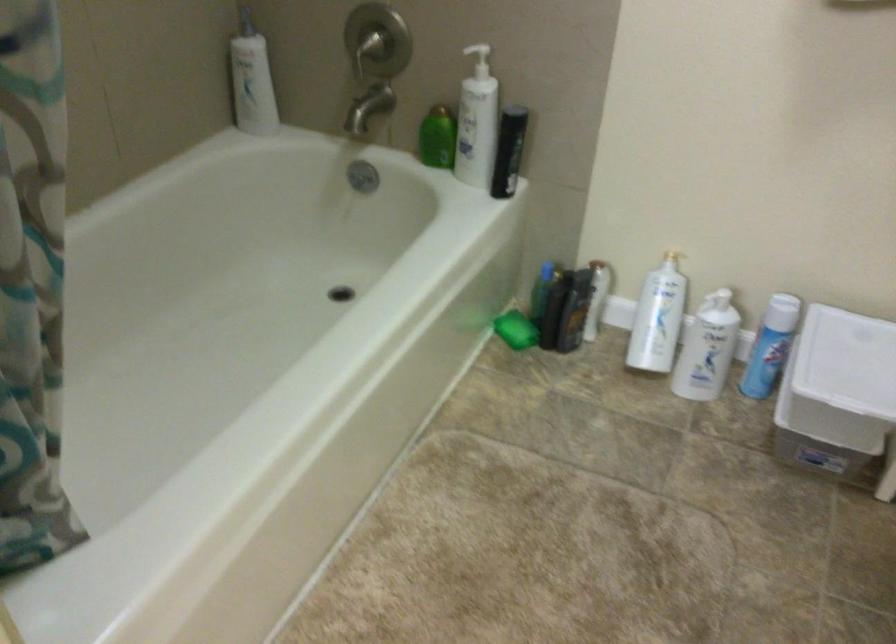
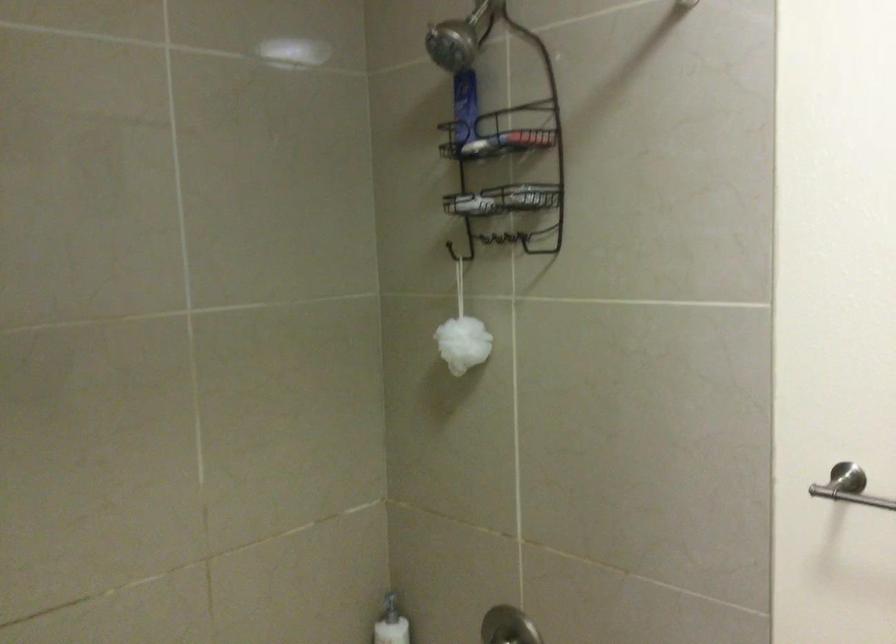
The images are taken continuously from a first-person perspective. In which direction is your viewpoint rotating?

The camera rotated toward left-up.